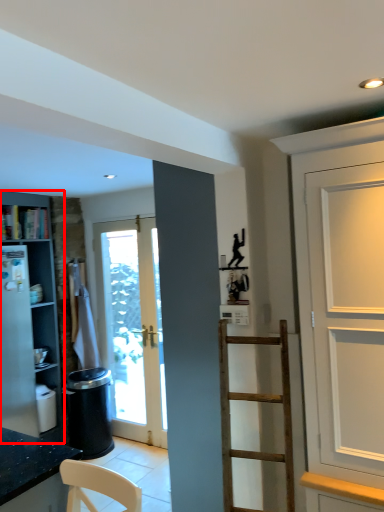
Question: Where is cabinetry (annotated by the red box) located in relation to cabinet in the image?

Choices:
 (A) left
 (B) right

Answer: (A)